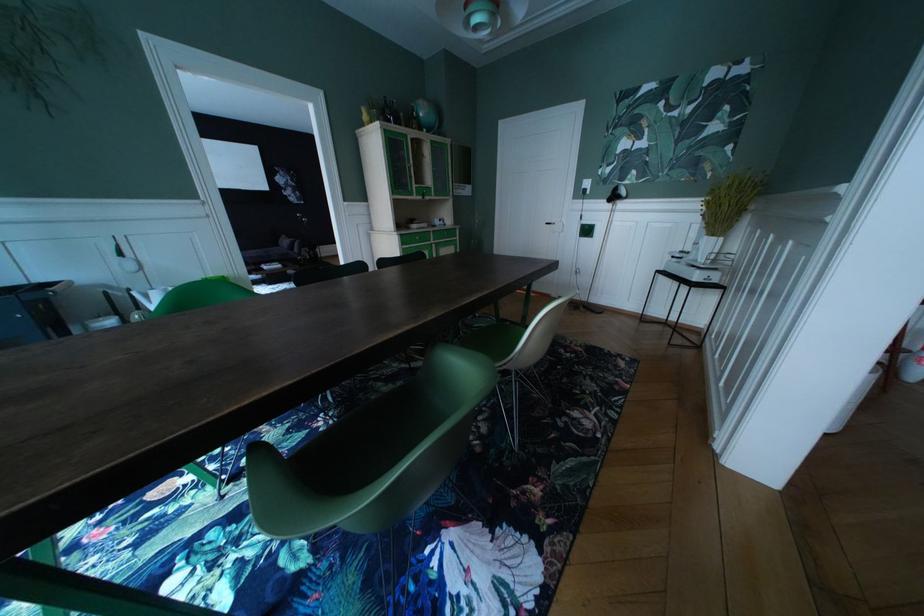
Which object does [426,114] point to?

It refers to a small blue globe.